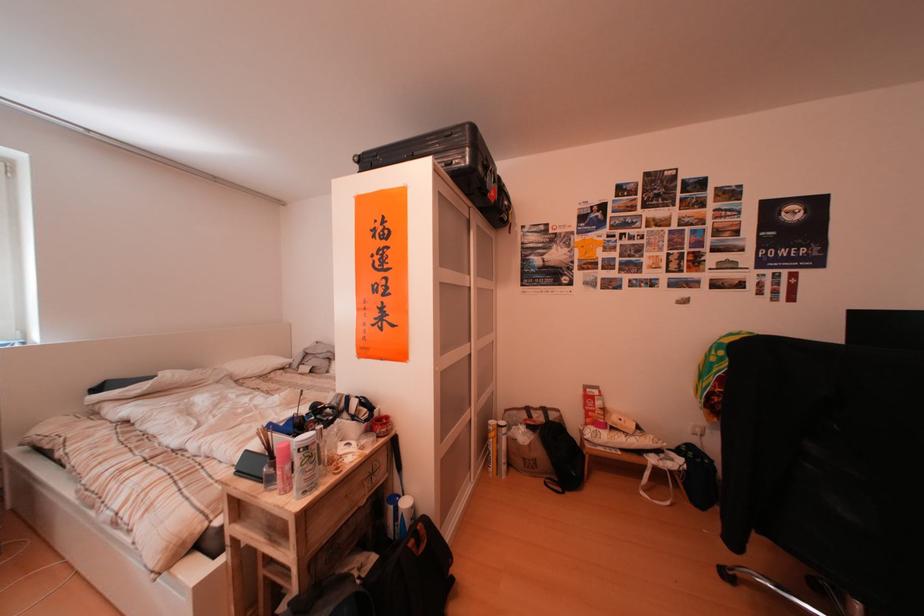
You are a GUI agent. You are given a task and a screenshot of the screen. Output one action in this format:
    pyautogui.click(x=<x>, y=<y>)
    Task: Click on the brown paper bag
    
    Given the screenshot: What is the action you would take?
    pyautogui.click(x=530, y=440)